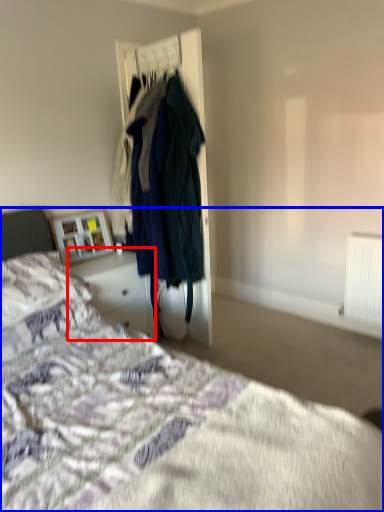
Question: Among these objects, which one is nearest to the camera, vanity (highlighted by a red box) or bed (highlighted by a blue box)?

Choices:
 (A) vanity
 (B) bed

Answer: (B)